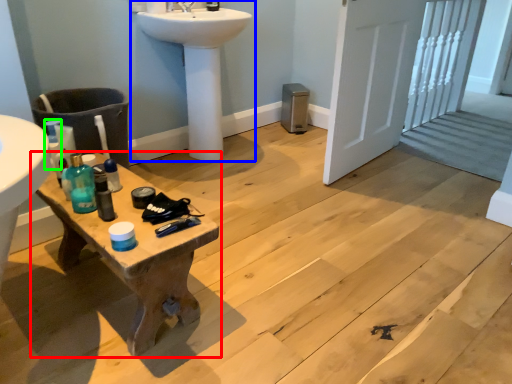
Question: Which is farther away from table (highlighted by a red box)? sink (highlighted by a blue box) or bottle (highlighted by a green box)?

Choices:
 (A) sink
 (B) bottle

Answer: (A)